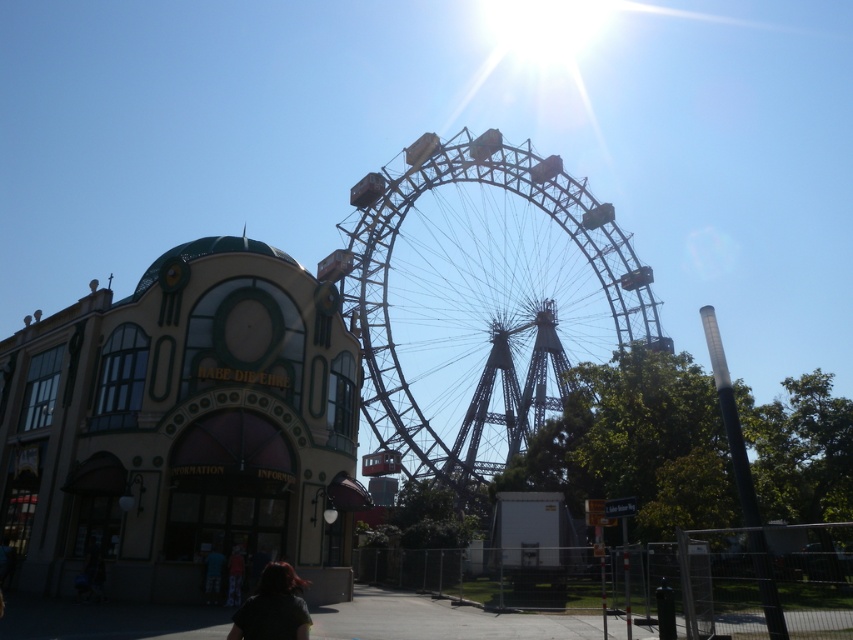
Question: Does metallic gray ferris wheel at center appear under dark hair at lower center?

Choices:
 (A) yes
 (B) no

Answer: (B)

Question: Considering the relative positions of metallic gray ferris wheel at center and dark hair at lower center in the image provided, where is metallic gray ferris wheel at center located with respect to dark hair at lower center?

Choices:
 (A) above
 (B) below

Answer: (A)

Question: Which object is closer to the camera taking this photo?

Choices:
 (A) metallic gray ferris wheel at center
 (B) dark hair at lower center

Answer: (B)

Question: Which point appears closest to the camera in this image?

Choices:
 (A) (380, 394)
 (B) (271, 563)

Answer: (A)

Question: Does metallic gray ferris wheel at center have a greater width compared to dark hair at lower center?

Choices:
 (A) no
 (B) yes

Answer: (B)

Question: Which point is farther to the camera?

Choices:
 (A) metallic gray ferris wheel at center
 (B) dark hair at lower center

Answer: (A)